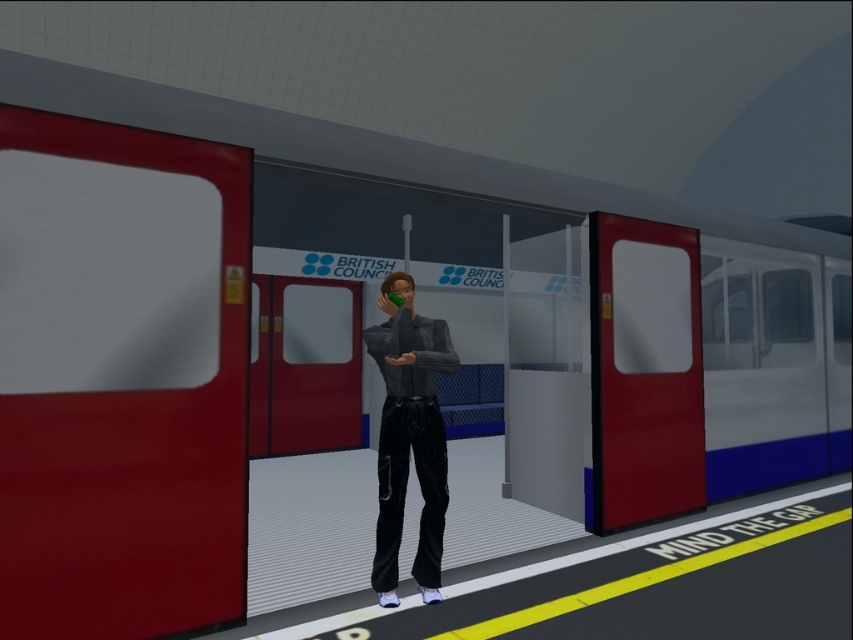
You are a passenger on the train station platform. You see the shiny black pants at center and the matte red door at right. Which object is closer to you as you stand facing the platform edge?

The shiny black pants at center is behind the matte red door at right, so the matte red door at right is closer to you.

You are a maintenance worker at the train station. You need to check the width of the matte red door at right and the shiny black pants at center to ensure they meet safety standards. Which object has a greater width?

The matte red door at right has a greater width than the shiny black pants at center according to the description.

You are a maintenance worker at the train station. You need to check the matte red door at right and the shiny black pants at center. Which object requires more space to access for maintenance? Explain your reasoning based on their sizes.

The matte red door at right requires more space to access for maintenance because it has a larger size compared to the shiny black pants at center.